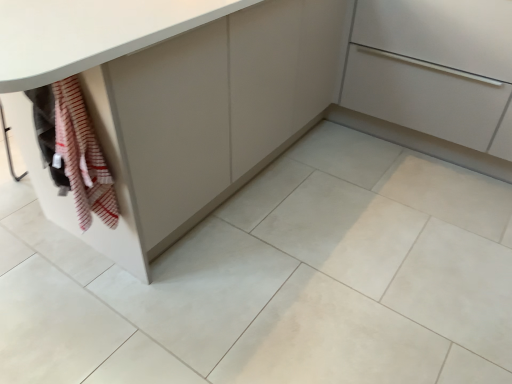
Where is `vacant space underneath matte gray cabinet at lower left, the 1th cabinetry viewed from the left (from a real-world perspective)`? This screenshot has width=512, height=384. vacant space underneath matte gray cabinet at lower left, the 1th cabinetry viewed from the left (from a real-world perspective) is located at coordinates (311, 240).